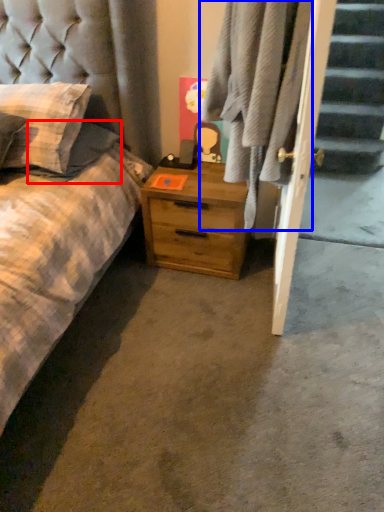
Question: Which object is further to the camera taking this photo, pillow (highlighted by a red box) or plaid (highlighted by a blue box)?

Choices:
 (A) pillow
 (B) plaid

Answer: (A)